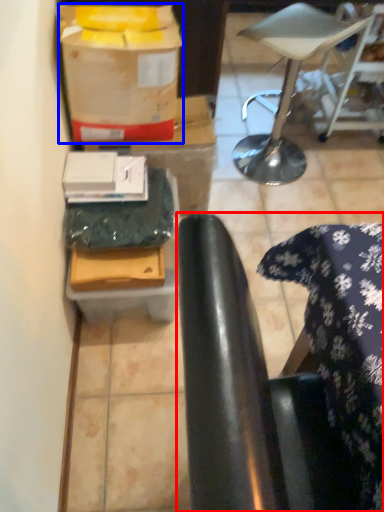
Question: Which object is further to the camera taking this photo, chair (highlighted by a red box) or wrapping paper (highlighted by a blue box)?

Choices:
 (A) chair
 (B) wrapping paper

Answer: (B)